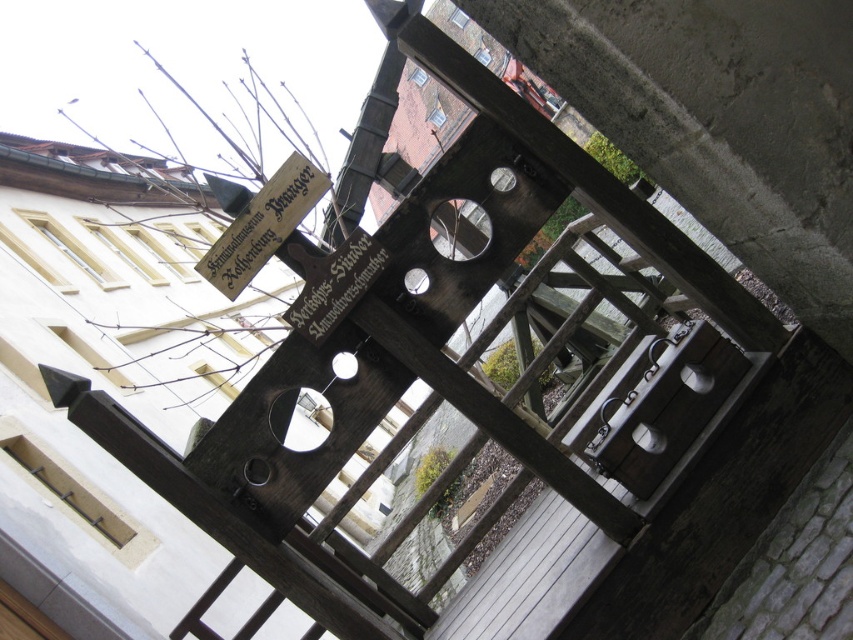
Question: Which point is farther from the camera taking this photo?

Choices:
 (A) (282, 232)
 (B) (355, 260)

Answer: (A)

Question: Which point appears farthest from the camera in this image?

Choices:
 (A) (334, 307)
 (B) (283, 163)

Answer: (B)

Question: Is wooden sign at upper left below wooden sign at center?

Choices:
 (A) yes
 (B) no

Answer: (B)

Question: Does wooden sign at upper left have a greater width compared to wooden sign at center?

Choices:
 (A) no
 (B) yes

Answer: (B)

Question: Is wooden sign at upper left positioned before wooden sign at center?

Choices:
 (A) no
 (B) yes

Answer: (B)

Question: Which object is farther from the camera taking this photo?

Choices:
 (A) wooden sign at upper left
 (B) wooden sign at center

Answer: (B)